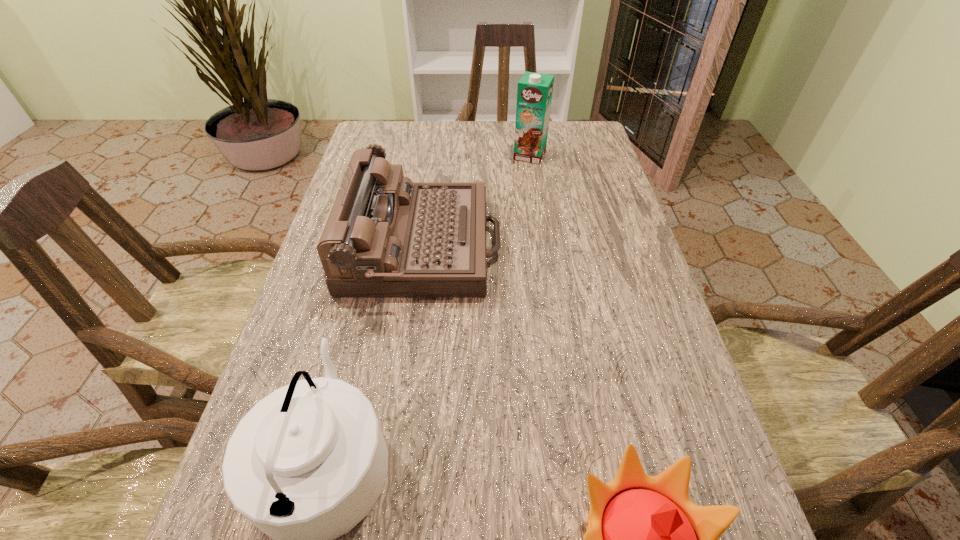
This screenshot has height=540, width=960. I want to click on the tallest object, so click(534, 93).

This screenshot has width=960, height=540. What are the coordinates of `the farthest object` in the screenshot? It's located at (534, 93).

You are a GUI agent. You are given a task and a screenshot of the screen. Output one action in this format:
    pyautogui.click(x=<x>, y=<y>)
    Task: Click on the typewriter
    
    Given the screenshot: What is the action you would take?
    pyautogui.click(x=386, y=236)

The image size is (960, 540). What are the coordinates of `free spot located 0.320m on the left of the carton` in the screenshot? It's located at (405, 155).

This screenshot has height=540, width=960. Find the location of `vacant area situated on the keyboard of the typewriter`. vacant area situated on the keyboard of the typewriter is located at coordinates (623, 245).

This screenshot has height=540, width=960. What are the coordinates of `object located in the far edge section of the desktop` in the screenshot? It's located at (534, 93).

Locate an element on the screen. The image size is (960, 540). object located in the left edge section of the desktop is located at coordinates (386, 236).

The height and width of the screenshot is (540, 960). In the image, there is a desktop. In order to click on vacant area at the far edge in this screenshot , I will do pyautogui.click(x=444, y=122).

Identify the location of vacant space at the right edge. Image resolution: width=960 pixels, height=540 pixels. (671, 384).

Where is `object identified as the closest to the crown`? This screenshot has width=960, height=540. object identified as the closest to the crown is located at coordinates pyautogui.click(x=306, y=464).